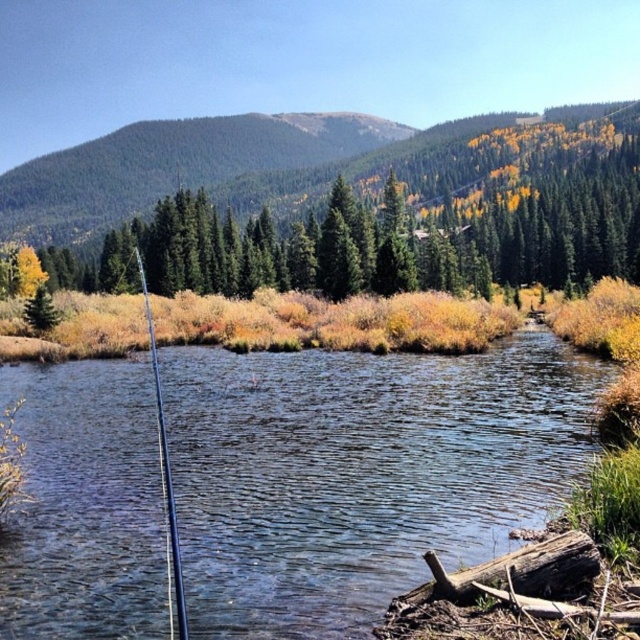
Question: Which of these objects is positioned farthest from the silver metallic fishing pole at center?

Choices:
 (A) green matte tree at upper center
 (B) clear water at center

Answer: (A)

Question: Can you confirm if clear water at center is positioned below green matte tree at upper center?

Choices:
 (A) yes
 (B) no

Answer: (A)

Question: Which object is farther from the camera taking this photo?

Choices:
 (A) green matte tree at upper center
 (B) clear water at center
 (C) silver metallic fishing pole at center

Answer: (A)

Question: Considering the relative positions of clear water at center and green matte tree at upper center in the image provided, where is clear water at center located with respect to green matte tree at upper center?

Choices:
 (A) right
 (B) left

Answer: (B)

Question: Among these objects, which one is farthest from the camera?

Choices:
 (A) green matte tree at upper center
 (B) clear water at center

Answer: (A)

Question: Does green matte tree at upper center appear under silver metallic fishing pole at center?

Choices:
 (A) yes
 (B) no

Answer: (B)